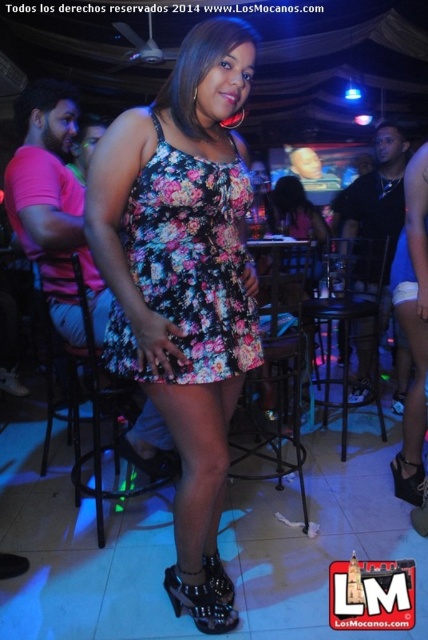
Question: Does floral fabric dress at center have a lesser width compared to black patent leather sandal at lower right?

Choices:
 (A) yes
 (B) no

Answer: (B)

Question: Which of the following is the farthest from the observer?

Choices:
 (A) (186, 54)
 (B) (216, 582)
 (C) (187, 586)

Answer: (B)

Question: Observing the image, what is the correct spatial positioning of floral-patterned fabric dress at center in reference to black leather high-heeled sandal at lower center?

Choices:
 (A) left
 (B) right

Answer: (A)

Question: Among these objects, which one is farthest from the camera?

Choices:
 (A) floral fabric dress at center
 (B) black patent leather sandal at lower center

Answer: (B)

Question: Does floral fabric dress at center appear under floral-patterned fabric dress at center?

Choices:
 (A) yes
 (B) no

Answer: (A)

Question: Which object is positioned farthest from the floral-patterned fabric dress at center?

Choices:
 (A) black patent leather sandal at lower right
 (B) black leather high-heeled sandal at lower center
 (C) floral fabric dress at center
 (D) black patent leather sandal at lower center

Answer: (A)